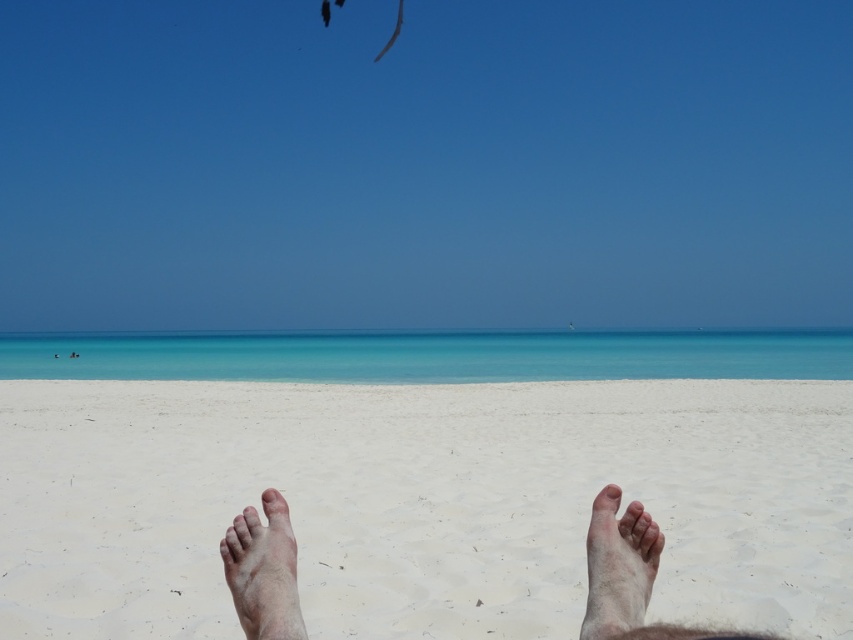
You are lying on the beach and see your dry skin foot at lower left and pale skin toe at center. Which part of your body is closer to the ocean?

The dry skin foot at lower left is taller than the pale skin toe at center, so the pale skin toe at center is closer to the ocean.

You are lying on the beach and want to place a small seashell between your dry skin foot at lower left and pale skin toe at lower center. Based on their positions, where should you place the seashell to ensure it is between them?

The dry skin foot at lower left is located below the pale skin toe at lower center, so placing the seashell between them would require positioning it above the dry skin foot at lower left and below the pale skin toe at lower center.

You are lying on the beach and see two points in the sand. One is at coordinates point (287, 513) and the other at point (273, 486). Which point is closer to your feet?

Point (287, 513) is in front of point (273, 486), so it is closer to your feet.